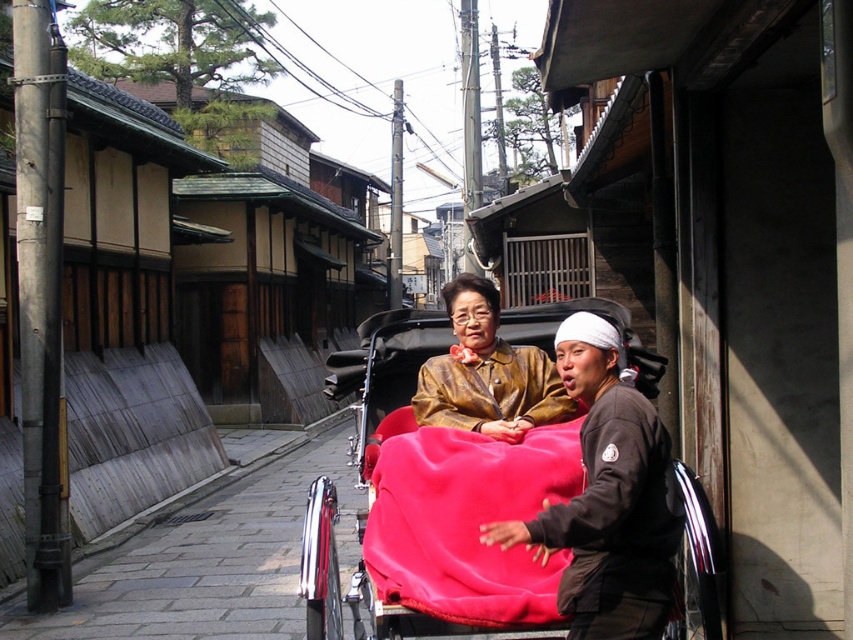
Between brown leather coach at center and bronze textured jacket at center, which one is positioned higher?

bronze textured jacket at center is higher up.

Is brown leather coach at center above bronze textured jacket at center?

Incorrect, brown leather coach at center is not positioned above bronze textured jacket at center.

Between point (610, 385) and point (494, 371), which one is positioned behind?

Positioned behind is point (494, 371).

This screenshot has height=640, width=853. I want to click on brown leather coach at center, so click(608, 497).

Between point (430, 564) and point (486, 464), which one is positioned in front?

Positioned in front is point (430, 564).

Is velvet red cart at center positioned in front of velvet-like red blanket at center?

That is False.

I want to click on velvet red cart at center, so click(x=431, y=502).

Can you confirm if velvet red cart at center is wider than bronze textured jacket at center?

Incorrect, velvet red cart at center's width does not surpass bronze textured jacket at center's.

Is velvet red cart at center in front of bronze textured jacket at center?

That is True.

Locate an element on the screen. This screenshot has width=853, height=640. velvet red cart at center is located at coordinates (431, 502).